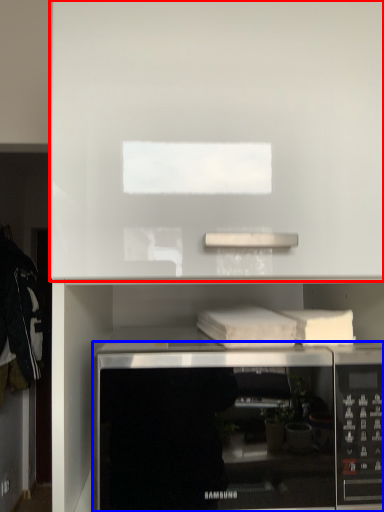
Question: Which of the following is the closest to the observer, cabinet (highlighted by a red box) or microwave oven (highlighted by a blue box)?

Choices:
 (A) cabinet
 (B) microwave oven

Answer: (A)